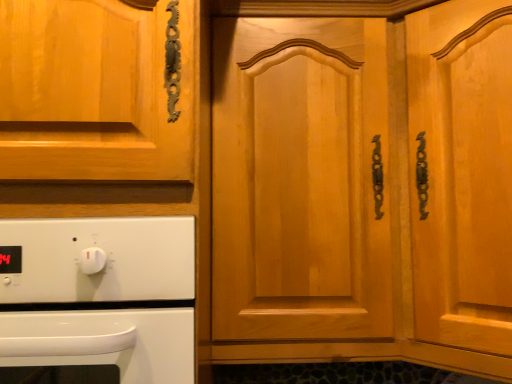
Question: Could you tell me if white glossy oven at lower left is facing light brown wood door at center?

Choices:
 (A) yes
 (B) no

Answer: (B)

Question: Considering the relative sizes of white glossy oven at lower left and light brown wood door at center in the image provided, is white glossy oven at lower left shorter than light brown wood door at center?

Choices:
 (A) no
 (B) yes

Answer: (B)

Question: Does white glossy oven at lower left have a greater width compared to light brown wood door at center?

Choices:
 (A) yes
 (B) no

Answer: (B)

Question: Can you confirm if white glossy oven at lower left is taller than light brown wood door at center?

Choices:
 (A) yes
 (B) no

Answer: (B)

Question: Is white glossy oven at lower left with light brown wood door at center?

Choices:
 (A) no
 (B) yes

Answer: (A)

Question: Is white glossy oven at lower left positioned in front of light brown wood door at center?

Choices:
 (A) no
 (B) yes

Answer: (B)

Question: Considering the relative sizes of light brown wood door at center and white glossy oven at lower left in the image provided, is light brown wood door at center smaller than white glossy oven at lower left?

Choices:
 (A) no
 (B) yes

Answer: (A)

Question: From the image's perspective, would you say light brown wood door at center is positioned over white glossy oven at lower left?

Choices:
 (A) yes
 (B) no

Answer: (A)

Question: Is light brown wood door at center bigger than white glossy oven at lower left?

Choices:
 (A) yes
 (B) no

Answer: (A)

Question: Is light brown wood door at center surrounding white glossy oven at lower left?

Choices:
 (A) no
 (B) yes

Answer: (A)

Question: Is light brown wood door at center closer to camera compared to white glossy oven at lower left?

Choices:
 (A) no
 (B) yes

Answer: (A)

Question: From a real-world perspective, is light brown wood door at center over white glossy oven at lower left?

Choices:
 (A) no
 (B) yes

Answer: (B)

Question: Is white glossy oven at lower left situated inside light brown wood door at center or outside?

Choices:
 (A) inside
 (B) outside

Answer: (B)